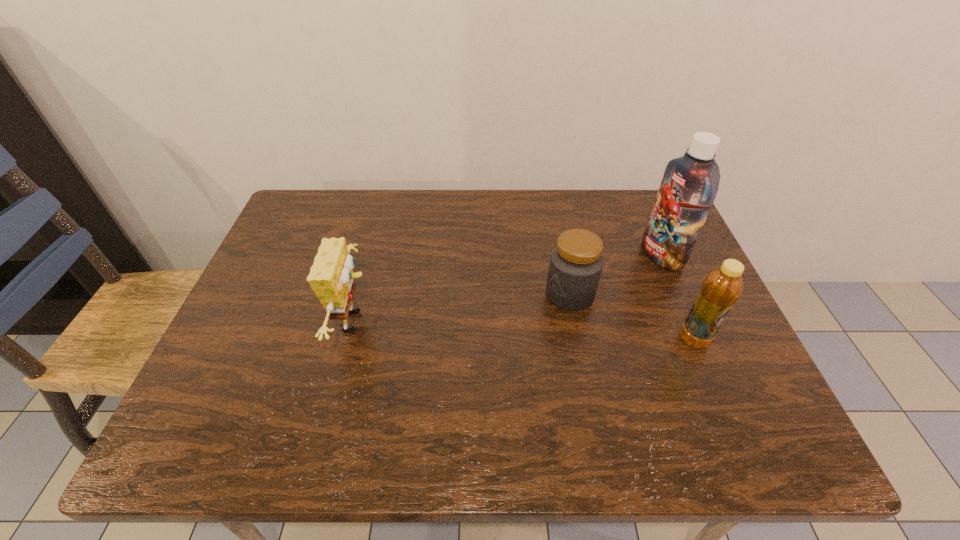
Find the location of a particular element. The height and width of the screenshot is (540, 960). free spot on the desktop that is between the sponge and the bottle and is positioned on the front label of the tallest object is located at coordinates (479, 328).

Locate an element on the screen. vacant space on the desktop that is between the leftmost object and the bottle and is positioned on the surface of the second object from left to right near the warning symbol is located at coordinates (492, 328).